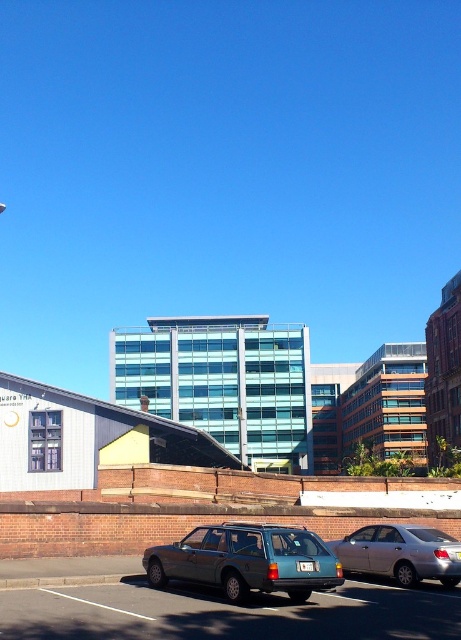
You are standing at the point labeled as point (247, 561) in the image. Which vehicle are you currently standing on?

The point labeled as point (247, 561) is located on the teal matte station wagon at center, so you are standing on the teal matte station wagon at center.

You are a delivery person needing to load a large package into the trunk of either the teal matte station wagon at center or the silver metallic sedan at center. Based on the size of the vehicles, which one would be more suitable for carrying the large package?

The teal matte station wagon at center has a larger size compared to the silver metallic sedan at center, so it would be more suitable for carrying the large package.

You are a delivery person needing to unload a package between the teal matte station wagon at center and the silver metallic sedan at center. The package requires 4 meters of space to safely maneuver. Can you fit the package between them?

The distance between the teal matte station wagon at center and the silver metallic sedan at center is 3.75 meters, which is less than the required 4 meters. Therefore, you cannot safely maneuver the package between them.